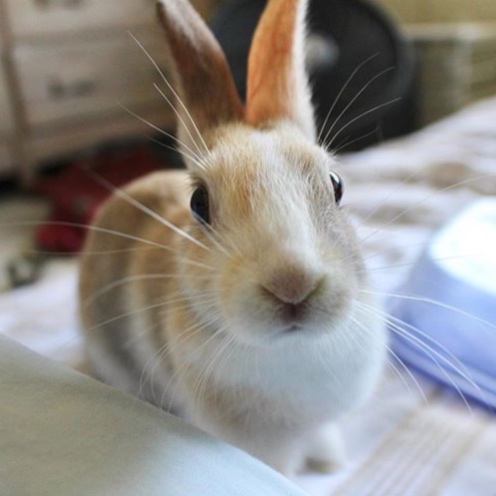
This screenshot has height=496, width=496. Find the location of `dresser`. dresser is located at coordinates (120, 73).